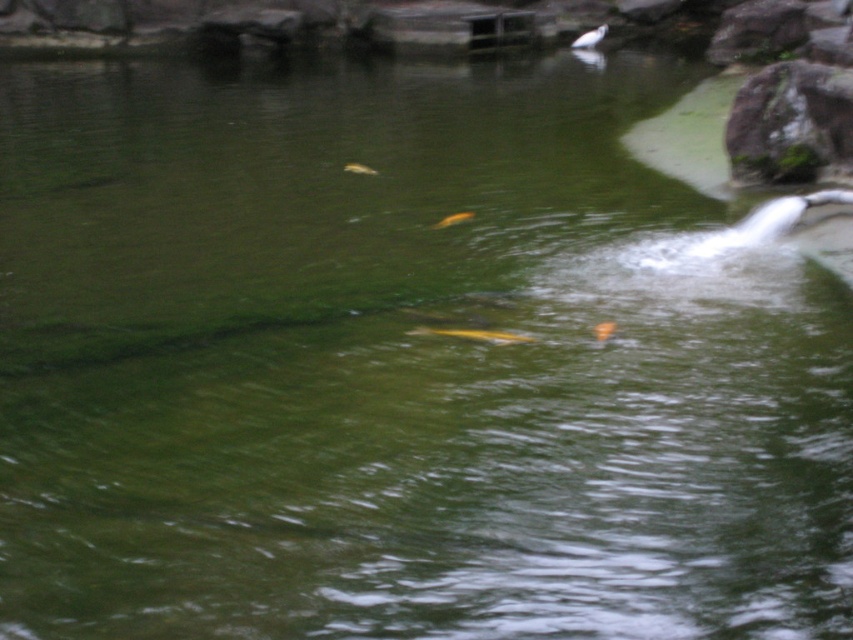
Question: Estimate the real-world distances between objects in this image. Which object is farther from the yellow shiny fish at center?

Choices:
 (A) white glossy bird at upper center
 (B) orange shiny fish at center
 (C) green mossy rock at upper right

Answer: (A)

Question: Does yellow shiny fish at center appear on the right side of shiny orange fish at center?

Choices:
 (A) yes
 (B) no

Answer: (B)

Question: Where is green mossy rock at upper right located in relation to shiny orange fish at center in the image?

Choices:
 (A) above
 (B) below

Answer: (A)

Question: Estimate the real-world distances between objects in this image. Which object is farther from the green mossy rock at upper right?

Choices:
 (A) orange shiny fish at center
 (B) yellow shiny fish at center
 (C) white glossy bird at upper center

Answer: (C)

Question: Considering the relative positions of green mossy rock at upper right and translucent yellow fish at center in the image provided, where is green mossy rock at upper right located with respect to translucent yellow fish at center?

Choices:
 (A) below
 (B) above

Answer: (B)

Question: Which point appears closest to the camera in this image?

Choices:
 (A) (511, 339)
 (B) (782, 65)
 (C) (456, 220)
 (D) (361, 168)

Answer: (A)